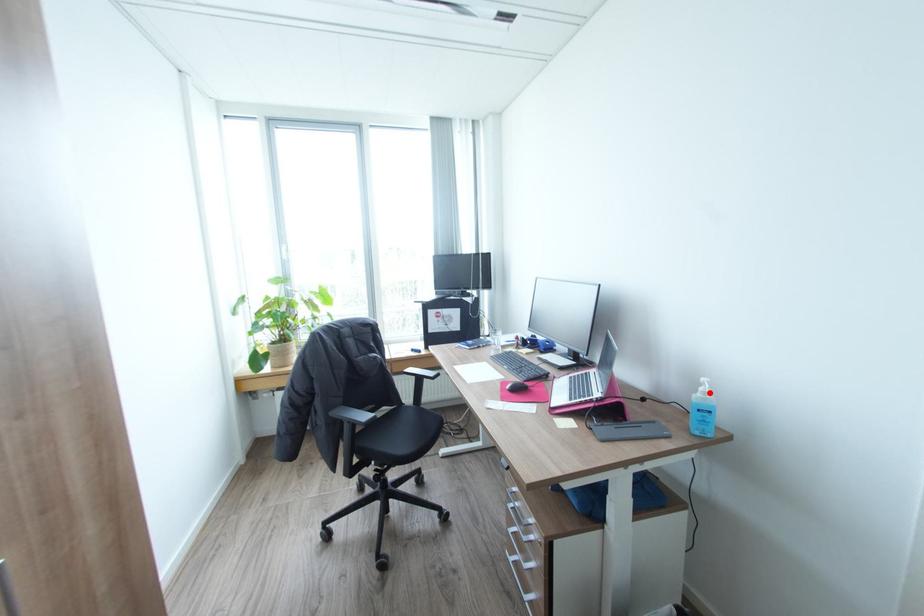
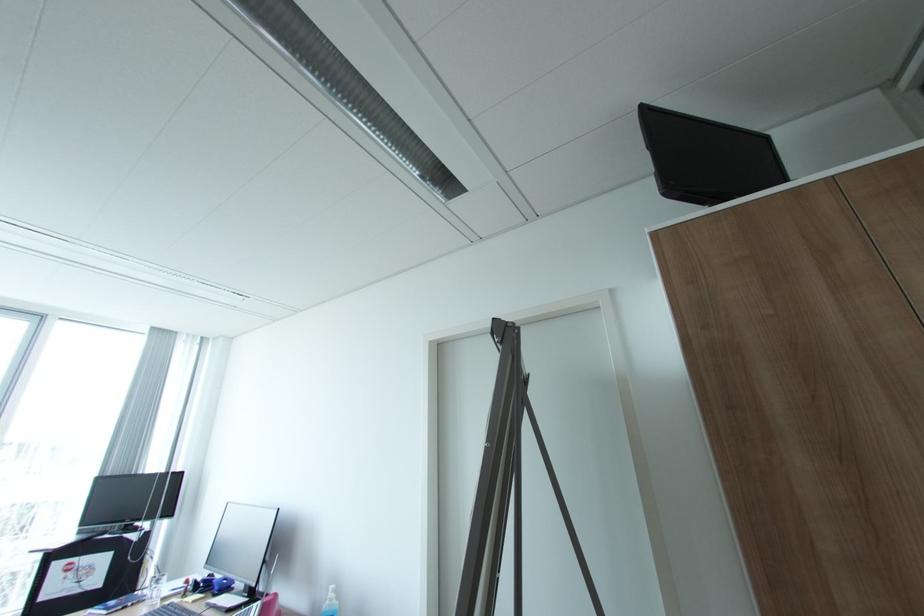
Find the pixel in the second image that matches the highlighted location in the first image.

(336, 599)